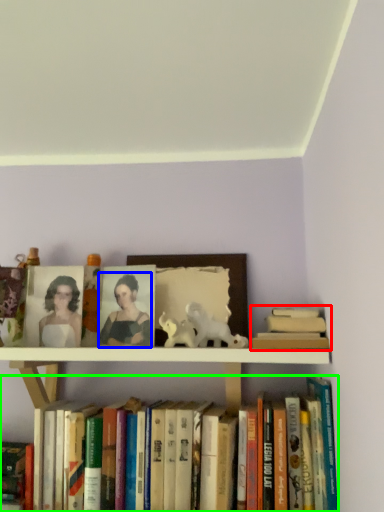
Question: Which object is positioned farthest from book (highlighted by a red box)? Select from person (highlighted by a blue box) and book (highlighted by a green box).

Choices:
 (A) person
 (B) book

Answer: (A)